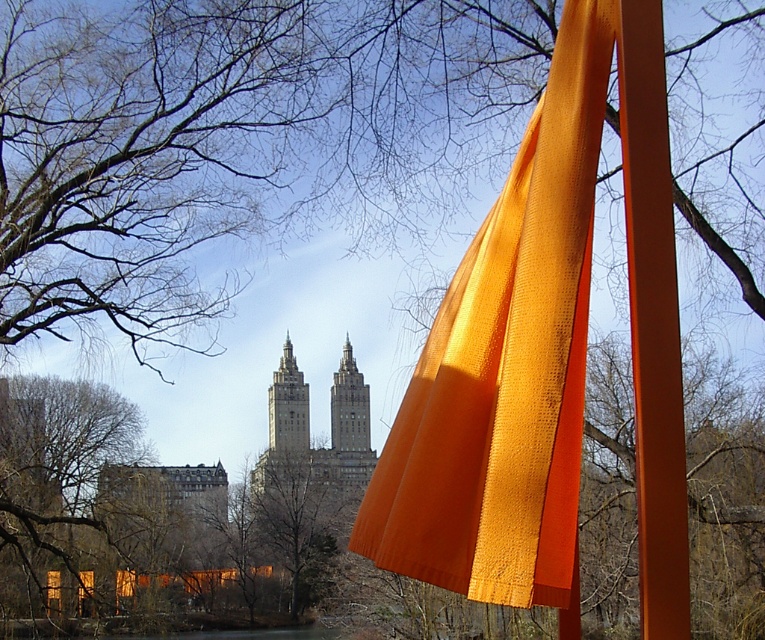
Question: Is orange fabric at center behind matte orange fabric at center?

Choices:
 (A) no
 (B) yes

Answer: (A)

Question: Does orange fabric at center appear over matte gray stone tower at center?

Choices:
 (A) yes
 (B) no

Answer: (A)

Question: Which point appears closest to the camera in this image?

Choices:
 (A) (506, 344)
 (B) (357, 442)

Answer: (A)

Question: Which of the following is the closest to the observer?

Choices:
 (A) [366, 472]
 (B) [669, 600]

Answer: (B)

Question: Which object is farther from the camera taking this photo?

Choices:
 (A) orange matte pole at right
 (B) matte gray stone tower at center
 (C) matte orange fabric at center
 (D) orange fabric at center

Answer: (C)

Question: Is matte gray stone tower at center to the right of matte orange fabric at center from the viewer's perspective?

Choices:
 (A) yes
 (B) no

Answer: (B)